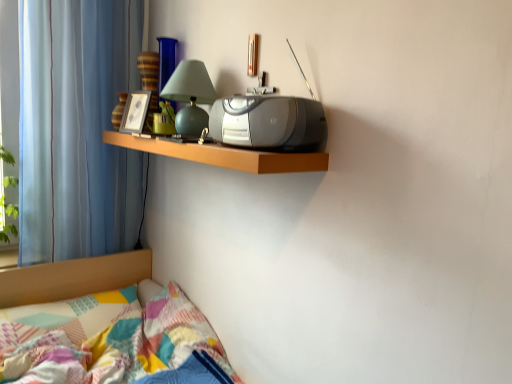
Question: Is patchwork fabric bed at lower left not within wooden shelf at upper center?

Choices:
 (A) no
 (B) yes

Answer: (B)

Question: From a real-world perspective, is patchwork fabric bed at lower left beneath wooden shelf at upper center?

Choices:
 (A) yes
 (B) no

Answer: (A)

Question: Can you confirm if patchwork fabric bed at lower left is bigger than wooden shelf at upper center?

Choices:
 (A) yes
 (B) no

Answer: (A)

Question: Considering the relative sizes of patchwork fabric bed at lower left and wooden shelf at upper center in the image provided, is patchwork fabric bed at lower left wider than wooden shelf at upper center?

Choices:
 (A) yes
 (B) no

Answer: (A)

Question: Is patchwork fabric bed at lower left further to camera compared to wooden shelf at upper center?

Choices:
 (A) no
 (B) yes

Answer: (B)

Question: From the image's perspective, is patchwork fabric bed at lower left located above or below blue striped curtain at left?

Choices:
 (A) below
 (B) above

Answer: (A)

Question: Is patchwork fabric bed at lower left taller or shorter than blue striped curtain at left?

Choices:
 (A) tall
 (B) short

Answer: (B)

Question: Looking at the image, does patchwork fabric bed at lower left seem bigger or smaller compared to blue striped curtain at left?

Choices:
 (A) big
 (B) small

Answer: (A)

Question: Looking at their shapes, would you say patchwork fabric bed at lower left is wider or thinner than blue striped curtain at left?

Choices:
 (A) wide
 (B) thin

Answer: (A)

Question: In terms of height, does matte green glass table lamp at upper center look taller or shorter compared to patchwork fabric bed at lower left?

Choices:
 (A) tall
 (B) short

Answer: (B)

Question: From the image's perspective, relative to patchwork fabric bed at lower left, is matte green glass table lamp at upper center above or below?

Choices:
 (A) above
 (B) below

Answer: (A)

Question: Is matte green glass table lamp at upper center to the left or to the right of patchwork fabric bed at lower left in the image?

Choices:
 (A) right
 (B) left

Answer: (A)

Question: In terms of size, does matte green glass table lamp at upper center appear bigger or smaller than patchwork fabric bed at lower left?

Choices:
 (A) big
 (B) small

Answer: (B)

Question: Is point (262, 170) closer or farther from the camera than point (64, 253)?

Choices:
 (A) closer
 (B) farther

Answer: (A)

Question: In terms of width, does wooden shelf at upper center look wider or thinner when compared to blue striped curtain at left?

Choices:
 (A) wide
 (B) thin

Answer: (A)